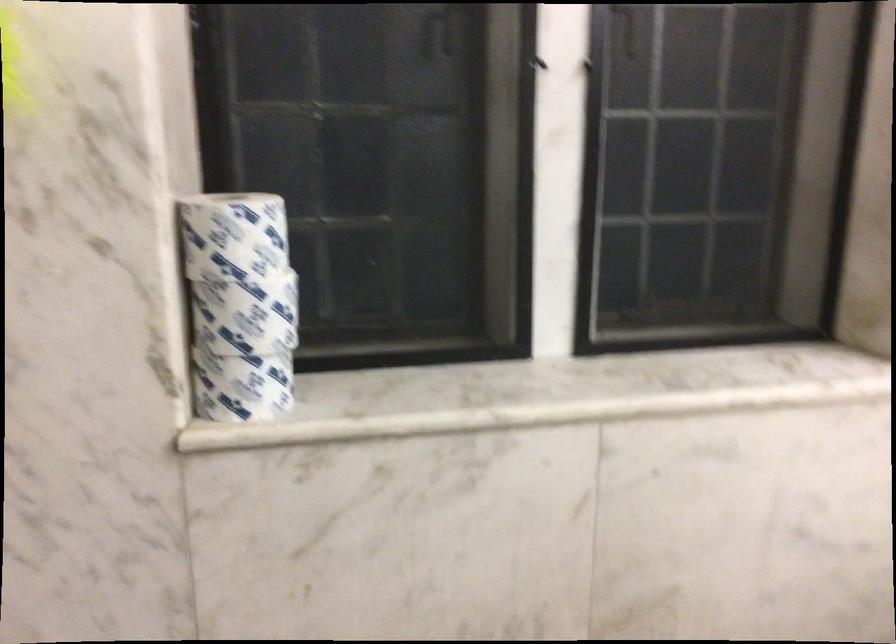
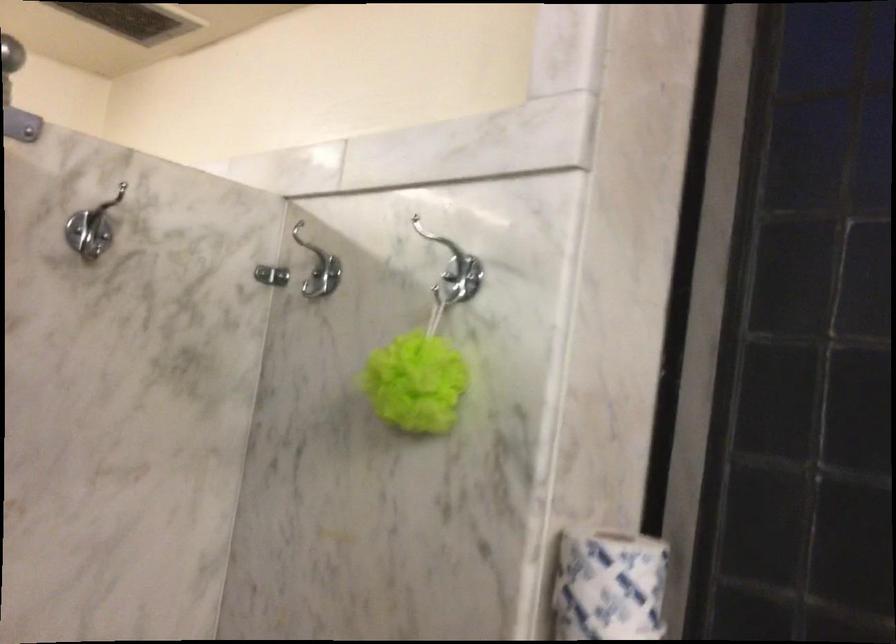
Question: The images are taken continuously from a first-person perspective. In which direction is your viewpoint rotating?

Choices:
 (A) Left
 (B) Right
 (C) Up
 (D) Down

Answer: (A)